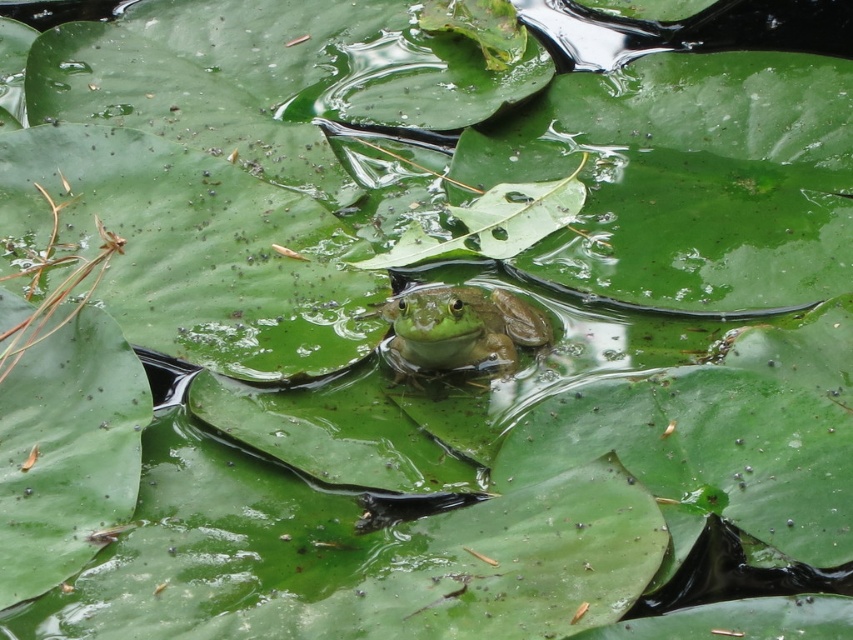
Question: Among these objects, which one is nearest to the camera?

Choices:
 (A) green matte leaf at center
 (B) green matte tree frog at center

Answer: (B)

Question: Is green matte tree frog at center to the left of green matte leaf at center from the viewer's perspective?

Choices:
 (A) yes
 (B) no

Answer: (A)

Question: From the image, what is the correct spatial relationship of green matte tree frog at center in relation to green matte leaf at center?

Choices:
 (A) below
 (B) above

Answer: (A)

Question: Which of the following is the closest to the observer?

Choices:
 (A) (397, 369)
 (B) (409, 246)

Answer: (A)

Question: Is green matte tree frog at center above green matte leaf at center?

Choices:
 (A) yes
 (B) no

Answer: (B)